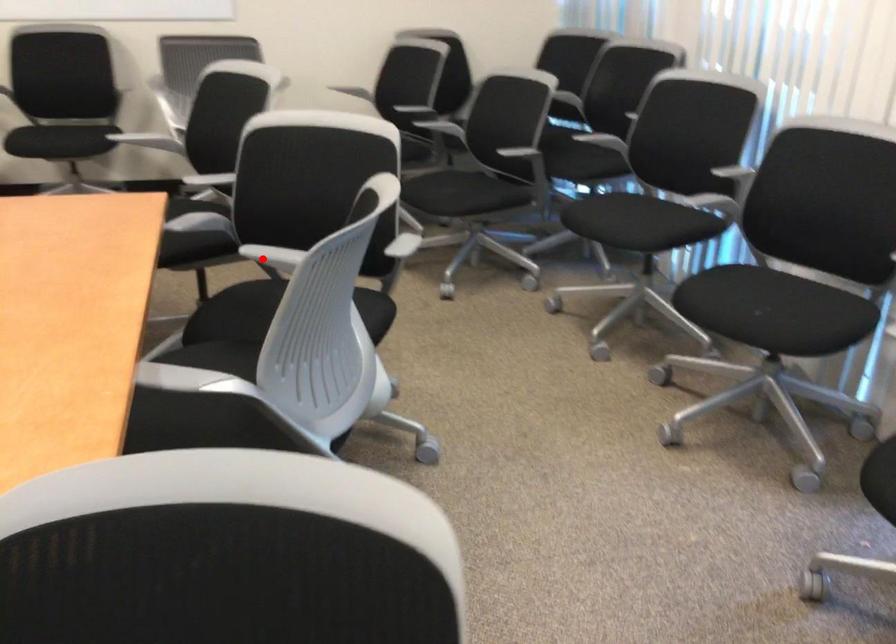
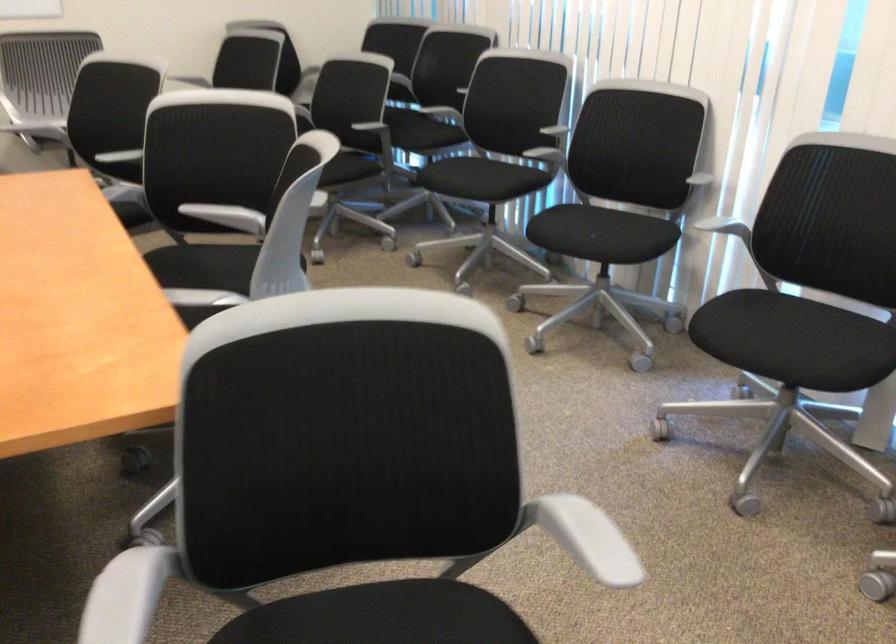
Where in the second image is the point corresponding to the highlighted location from the first image?

(208, 212)